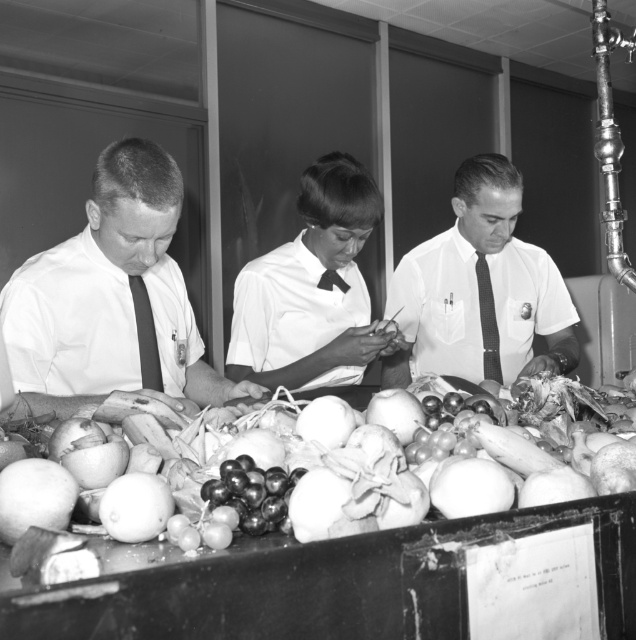
Is point (457, 193) farther from camera compared to point (319, 285)?

Yes.

Is point (543, 333) positioned after point (342, 288)?

That is True.

This screenshot has height=640, width=636. Identify the location of white shirt at center. (480, 291).

Can you confirm if black silk tie at left is shorter than black silk tie at center?

No, black silk tie at left is not shorter than black silk tie at center.

Between point (160, 378) and point (336, 284), which one is positioned in front?

Point (160, 378) is more forward.

What are the coordinates of `black silk tie at left` in the screenshot? It's located at (146, 336).

Measure the distance from smooth white onion at center to black silk tie at left.

smooth white onion at center is 28.24 inches away from black silk tie at left.

Who is lower down, smooth white onion at center or black silk tie at left?

Positioned lower is smooth white onion at center.

This screenshot has height=640, width=636. Identify the location of smooth white onion at center. (307, 474).